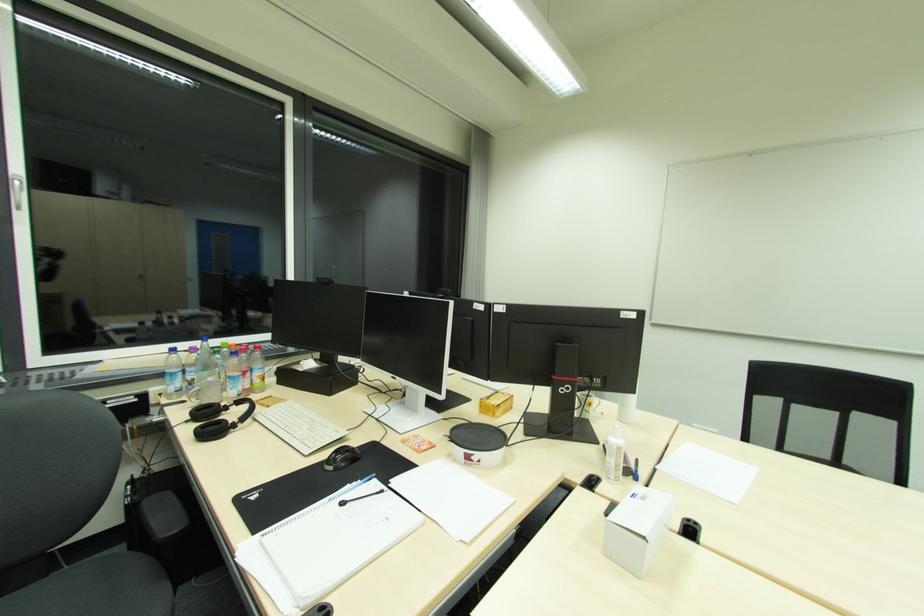
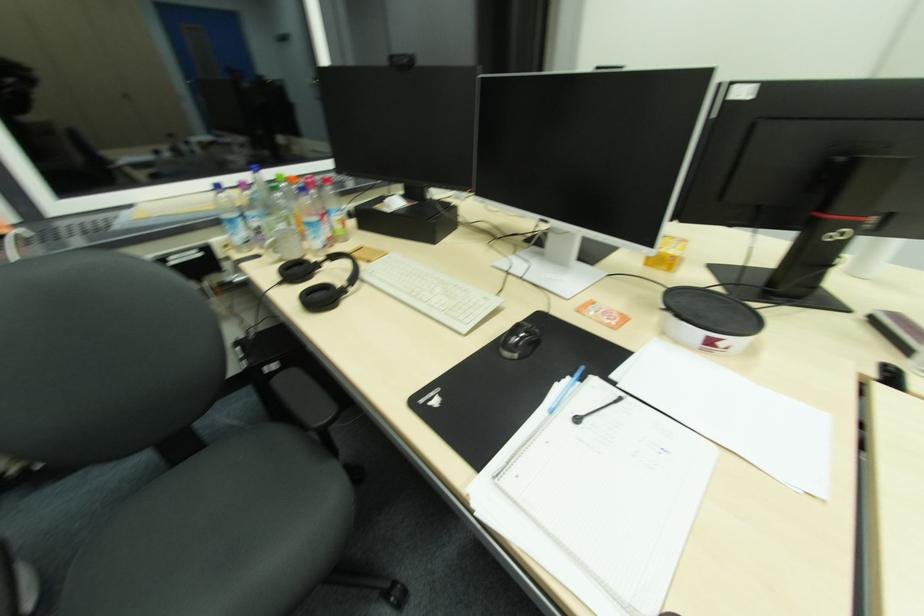
In a continuous first-person perspective shot, in which direction is the camera moving?

The cameraman walked toward left, forward.